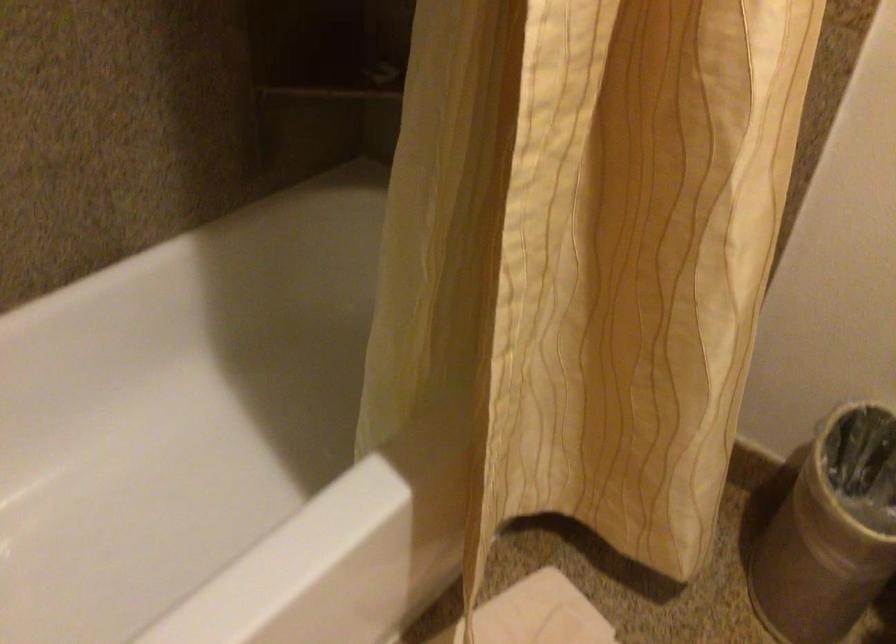
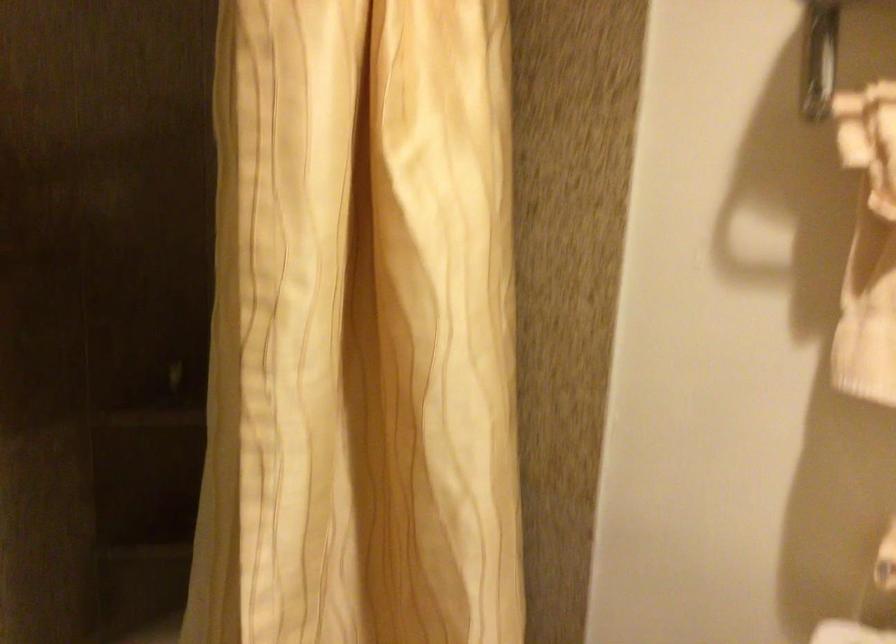
What movement of the cameraman would produce the second image?

The cameraman walked toward right, backward.